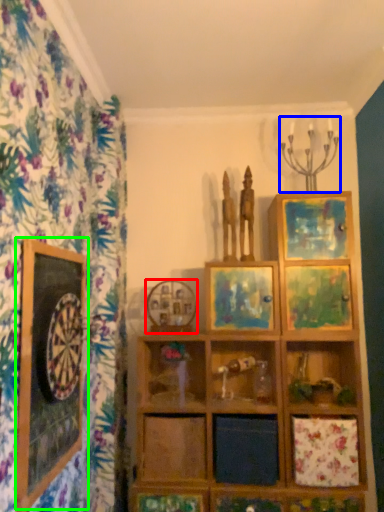
Question: Based on their relative distances, which object is nearer to picture frame (highlighted by a red box)? Choose from candle holder (highlighted by a blue box) and picture frame (highlighted by a green box).

Choices:
 (A) candle holder
 (B) picture frame

Answer: (B)